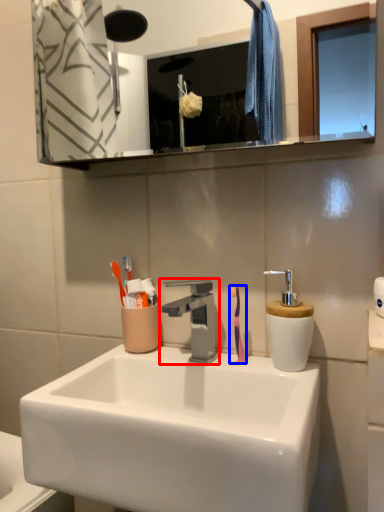
Question: Which of the following is the closest to the observer, tap (highlighted by a red box) or toothbrush (highlighted by a blue box)?

Choices:
 (A) tap
 (B) toothbrush

Answer: (A)